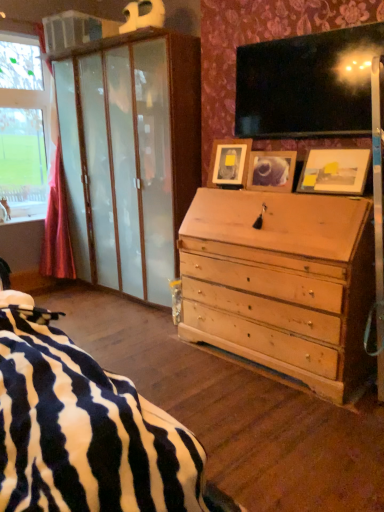
Question: Does wooden picture frame at center, positioned as the 2th picture frame in left-to-right order, come behind wooden picture frame at center, the 1th picture frame positioned from the left?

Choices:
 (A) no
 (B) yes

Answer: (A)

Question: Are wooden picture frame at center, positioned as the 2th picture frame in left-to-right order, and wooden picture frame at center, the 1th picture frame positioned from the left, far apart?

Choices:
 (A) yes
 (B) no

Answer: (B)

Question: From the image's perspective, is wooden picture frame at center, acting as the second picture frame starting from the right, on top of wooden picture frame at center, the 1th picture frame positioned from the left?

Choices:
 (A) yes
 (B) no

Answer: (B)

Question: From a real-world perspective, is wooden picture frame at center, acting as the second picture frame starting from the right, positioned under wooden picture frame at center, the 1th picture frame positioned from the left, based on gravity?

Choices:
 (A) yes
 (B) no

Answer: (A)

Question: Is wooden picture frame at center, positioned as the 2th picture frame in left-to-right order, thinner than wooden picture frame at center, which ranks as the third picture frame in right-to-left order?

Choices:
 (A) yes
 (B) no

Answer: (A)

Question: Does wooden picture frame at center, acting as the second picture frame starting from the right, have a greater height compared to wooden picture frame at center, which ranks as the third picture frame in right-to-left order?

Choices:
 (A) yes
 (B) no

Answer: (B)

Question: Is wooden photo frame at upper right, positioned as the first picture frame in right-to-left order, completely or partially outside of wooden picture frame at center, the 1th picture frame positioned from the left?

Choices:
 (A) no
 (B) yes

Answer: (B)

Question: Is wooden photo frame at upper right, marked as the 3th picture frame in a left-to-right arrangement, further to camera compared to wooden picture frame at center, which ranks as the third picture frame in right-to-left order?

Choices:
 (A) no
 (B) yes

Answer: (A)

Question: Considering the relative sizes of wooden photo frame at upper right, positioned as the first picture frame in right-to-left order, and wooden picture frame at center, the 1th picture frame positioned from the left, in the image provided, is wooden photo frame at upper right, positioned as the first picture frame in right-to-left order, shorter than wooden picture frame at center, the 1th picture frame positioned from the left,?

Choices:
 (A) yes
 (B) no

Answer: (A)

Question: Is wooden photo frame at upper right, marked as the 3th picture frame in a left-to-right arrangement, oriented towards wooden picture frame at center, which ranks as the third picture frame in right-to-left order?

Choices:
 (A) yes
 (B) no

Answer: (B)

Question: Is wooden photo frame at upper right, marked as the 3th picture frame in a left-to-right arrangement, to the right of wooden picture frame at center, the 1th picture frame positioned from the left, from the viewer's perspective?

Choices:
 (A) yes
 (B) no

Answer: (A)

Question: Can you confirm if wooden photo frame at upper right, marked as the 3th picture frame in a left-to-right arrangement, is thinner than wooden picture frame at center, the 1th picture frame positioned from the left?

Choices:
 (A) yes
 (B) no

Answer: (B)

Question: Can you confirm if wooden photo frame at upper right, marked as the 3th picture frame in a left-to-right arrangement, is wider than wooden picture frame at center, acting as the second picture frame starting from the right?

Choices:
 (A) yes
 (B) no

Answer: (A)